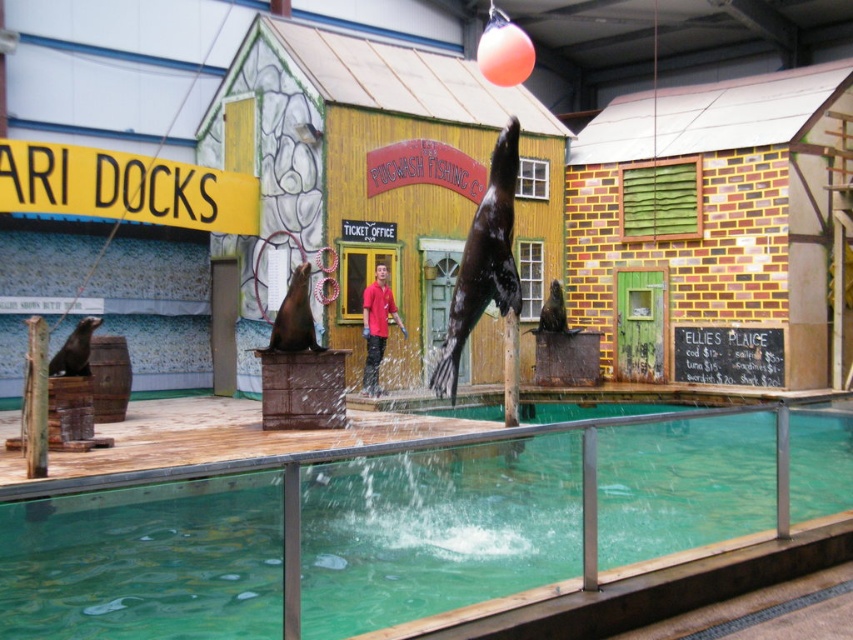
Is orange rubber balloon at upper center thinner than red matte shirt at center?

Correct, orange rubber balloon at upper center's width is less than red matte shirt at center's.

Is point (508, 29) positioned before point (383, 324)?

Yes, point (508, 29) is closer to viewer.

Identify the location of orange rubber balloon at upper center. (505, 54).

Between point (100, 520) and point (370, 292), which one is positioned behind?

The point (370, 292) is more distant.

Is point (387, 481) more distant than point (364, 310)?

No, (387, 481) is closer to viewer.

The height and width of the screenshot is (640, 853). I want to click on green glass water at center, so click(x=434, y=529).

The width and height of the screenshot is (853, 640). I want to click on green glass water at center, so click(x=434, y=529).

Based on the photo, is green glass water at center to the left of orange rubber balloon at upper center from the viewer's perspective?

Result: In fact, green glass water at center is to the right of orange rubber balloon at upper center.

Can you confirm if green glass water at center is positioned to the right of orange rubber balloon at upper center?

Yes, green glass water at center is to the right of orange rubber balloon at upper center.

Is point (379, 461) more distant than point (491, 44)?

No, it is not.

Where is `green glass water at center`? green glass water at center is located at coordinates (434, 529).